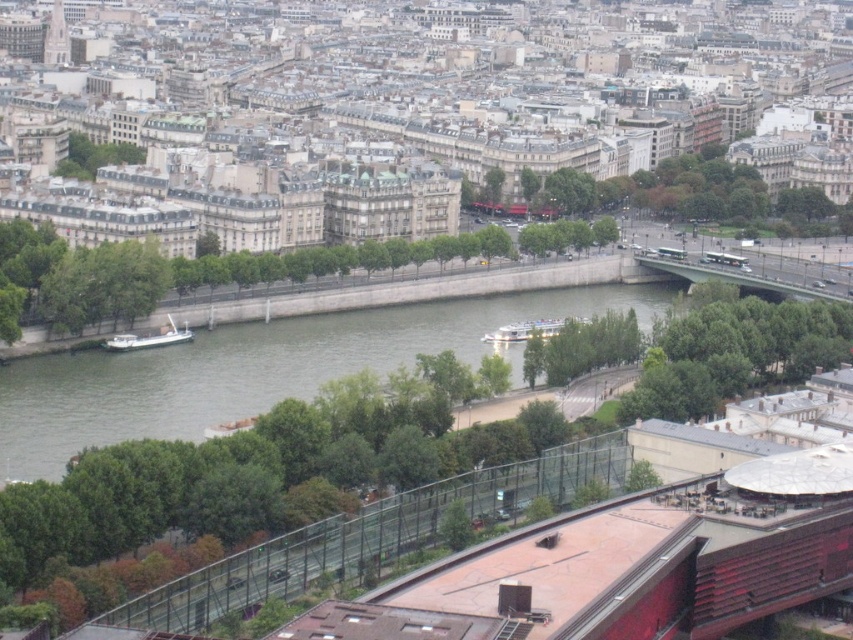
You are a tourist in Paris and you see the green water at center and the brushed metal eiffel tower at upper left. Which object is located higher in the image?

The brushed metal eiffel tower at upper left is located higher in the image than the green water at center.

Looking at this image, you are a photographer planning to capture the entire scene in one shot. Given that the green water at center and the brushed metal eiffel tower at upper left are both in your frame, which object occupies more horizontal space in the image?

The green water at center occupies more horizontal space because its width is larger than that of the brushed metal eiffel tower at upper left.